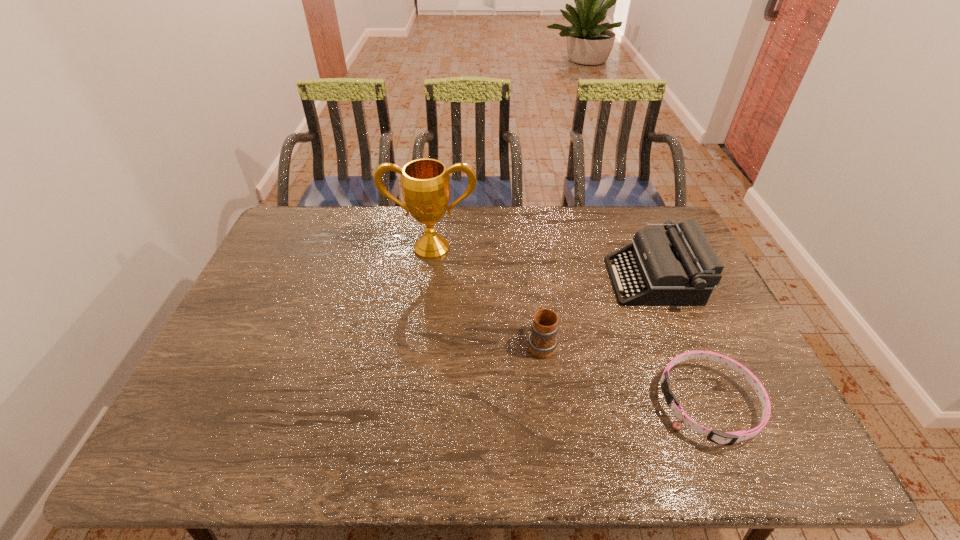
The height and width of the screenshot is (540, 960). In order to click on award in this screenshot , I will do `click(425, 183)`.

Identify the location of the leftmost object. (425, 183).

The height and width of the screenshot is (540, 960). What are the coordinates of `typewriter` in the screenshot? It's located at (679, 267).

Where is `the third farthest object`? the third farthest object is located at coordinates (542, 341).

You are a GUI agent. You are given a task and a screenshot of the screen. Output one action in this format:
    pyautogui.click(x=<x>, y=<y>)
    Task: Click on the mug
    
    Given the screenshot: What is the action you would take?
    pyautogui.click(x=542, y=341)

Image resolution: width=960 pixels, height=540 pixels. I want to click on the nearest object, so click(728, 438).

Where is `the shortest object`? The image size is (960, 540). the shortest object is located at coordinates (728, 438).

I want to click on free space located on the front-facing side of the award, so click(x=426, y=293).

This screenshot has height=540, width=960. I want to click on vacant space located on the typing side of the typewriter, so click(522, 280).

The image size is (960, 540). Identify the location of free space located 0.080m on the typing side of the typewriter. (586, 280).